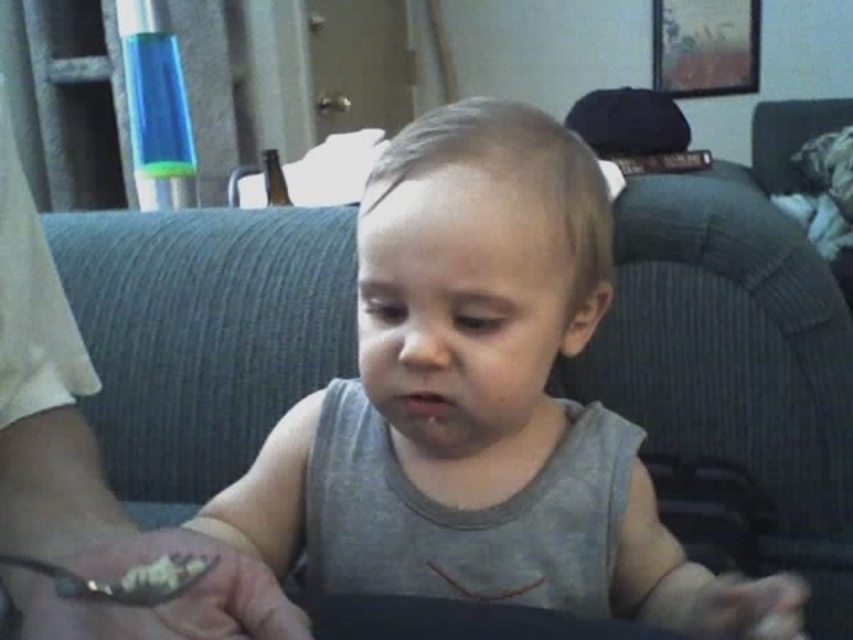
Does gray cotton toddler at center have a greater width compared to white creamy food at lower center?

Yes, gray cotton toddler at center is wider than white creamy food at lower center.

Describe the element at coordinates (480, 404) in the screenshot. This screenshot has height=640, width=853. I see `gray cotton toddler at center` at that location.

Which is in front, point (309, 468) or point (120, 580)?

Point (120, 580)

Identify the location of gray cotton toddler at center. Image resolution: width=853 pixels, height=640 pixels. (480, 404).